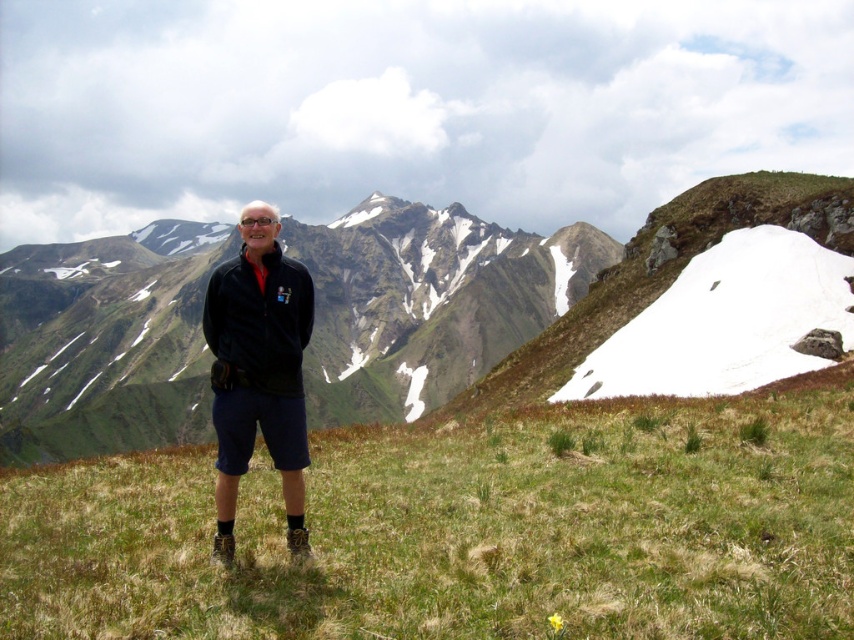
Question: Can you confirm if green grassy at center is thinner than green grassy hillside at center?

Choices:
 (A) no
 (B) yes

Answer: (B)

Question: Which object is positioned farthest from the black matte jacket at center?

Choices:
 (A) green grassy hillside at center
 (B) green grassy at center

Answer: (A)

Question: Which of the following is the farthest from the observer?

Choices:
 (A) (156, 348)
 (B) (221, 410)
 (C) (342, 586)

Answer: (A)

Question: Among these objects, which one is nearest to the camera?

Choices:
 (A) green grassy hillside at center
 (B) black matte jacket at center
 (C) green grassy at center

Answer: (C)

Question: Can you confirm if green grassy at center is positioned to the left of green grassy hillside at center?

Choices:
 (A) no
 (B) yes

Answer: (A)

Question: Does green grassy at center appear under green grassy hillside at center?

Choices:
 (A) yes
 (B) no

Answer: (A)